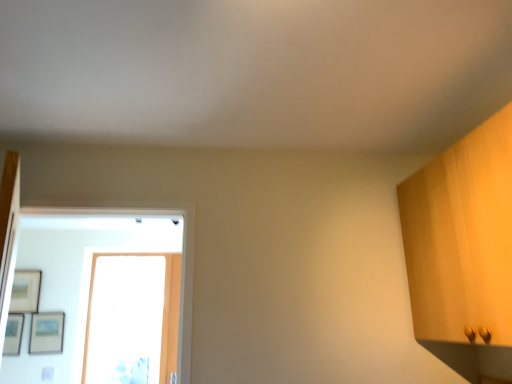
Question: Can you confirm if matte wooden picture frame at upper left, arranged as the 1th picture frame when viewed from the left, is bigger than transparent glass door at center?

Choices:
 (A) no
 (B) yes

Answer: (A)

Question: Is matte wooden picture frame at upper left, which is counted as the third picture frame, starting from the right, to the right of transparent glass door at center from the viewer's perspective?

Choices:
 (A) no
 (B) yes

Answer: (A)

Question: From a real-world perspective, does matte wooden picture frame at upper left, which is counted as the third picture frame, starting from the right, sit lower than transparent glass door at center?

Choices:
 (A) no
 (B) yes

Answer: (A)

Question: Would you say matte wooden picture frame at upper left, which is counted as the third picture frame, starting from the right, is outside transparent glass door at center?

Choices:
 (A) yes
 (B) no

Answer: (A)

Question: Is matte wooden picture frame at upper left, which is counted as the third picture frame, starting from the right, far away from transparent glass door at center?

Choices:
 (A) no
 (B) yes

Answer: (A)

Question: From a real-world perspective, is matte wooden picture frame at upper left, which is counted as the third picture frame, starting from the right, positioned over transparent glass door at center based on gravity?

Choices:
 (A) yes
 (B) no

Answer: (A)

Question: From the image's perspective, is matte wooden picture frame at upper left, arranged as the 1th picture frame when viewed from the left, located above matte black picture frame at left, which is counted as the 2th picture frame, starting from the right?

Choices:
 (A) no
 (B) yes

Answer: (B)

Question: Can we say matte wooden picture frame at upper left, arranged as the 1th picture frame when viewed from the left, lies outside matte black picture frame at left, which is counted as the 2th picture frame, starting from the right?

Choices:
 (A) yes
 (B) no

Answer: (A)

Question: Could you tell me if matte wooden picture frame at upper left, which is counted as the third picture frame, starting from the right, is facing matte black picture frame at left, marked as the second picture frame in a left-to-right arrangement?

Choices:
 (A) no
 (B) yes

Answer: (A)

Question: Is matte wooden picture frame at upper left, arranged as the 1th picture frame when viewed from the left, thinner than matte black picture frame at left, which is counted as the 2th picture frame, starting from the right?

Choices:
 (A) no
 (B) yes

Answer: (A)

Question: From a real-world perspective, is matte wooden picture frame at upper left, which is counted as the third picture frame, starting from the right, below matte black picture frame at left, which is counted as the 2th picture frame, starting from the right?

Choices:
 (A) yes
 (B) no

Answer: (B)

Question: Is there a large distance between matte wooden picture frame at upper left, which is counted as the third picture frame, starting from the right, and matte black picture frame at left, marked as the second picture frame in a left-to-right arrangement?

Choices:
 (A) no
 (B) yes

Answer: (A)

Question: Could matte black picture frame at left, marked as the second picture frame in a left-to-right arrangement, be considered to be inside transparent glass door at center?

Choices:
 (A) no
 (B) yes

Answer: (A)